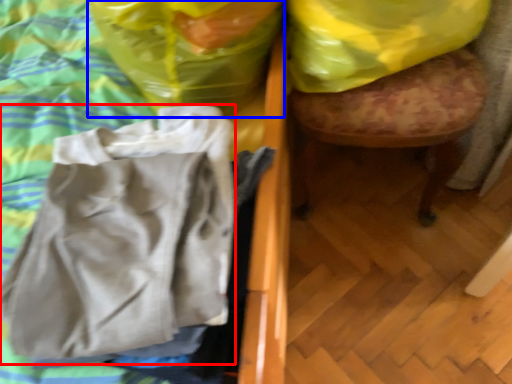
Question: Which point is closer to the camera, wrap (highlighted by a red box) or plastic bag (highlighted by a blue box)?

Choices:
 (A) wrap
 (B) plastic bag

Answer: (A)